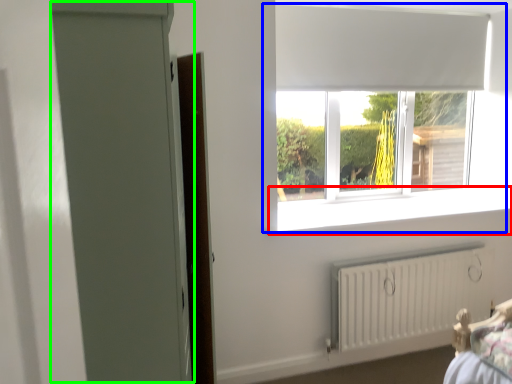
Question: Estimate the real-world distances between objects in this image. Which object is closer to window sill (highlighted by a red box), window (highlighted by a blue box) or screen door (highlighted by a green box)?

Choices:
 (A) window
 (B) screen door

Answer: (A)